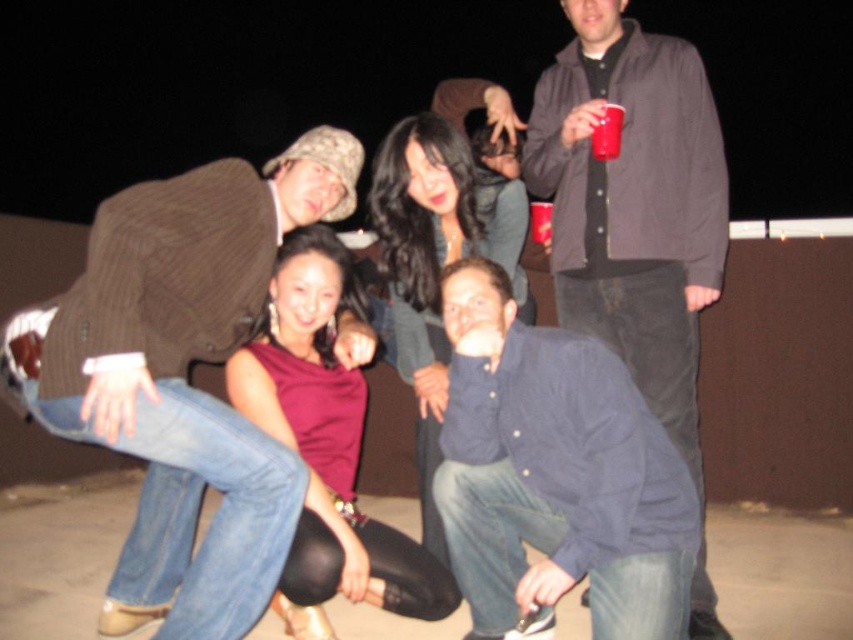
You are a photographer who just took a nighttime group photo on a rooftop. In the image, you notice the brown corduroy jacket at upper left and the shiny black hair at center. Based on their positions, which object is higher in the frame?

The shiny black hair at center is higher in the frame because the brown corduroy jacket at upper left is located below it.

You are a photographer trying to adjust the lighting for a group photo. You notice the dark gray jacket at upper right and the shiny black hair at center. Which object should you focus on first to ensure proper exposure, considering their positions in the frame?

The dark gray jacket at upper right is above shiny black hair at center, so focusing on the shiny black hair at center first would ensure proper exposure since it is closer to the camera and in the central area of the frame.